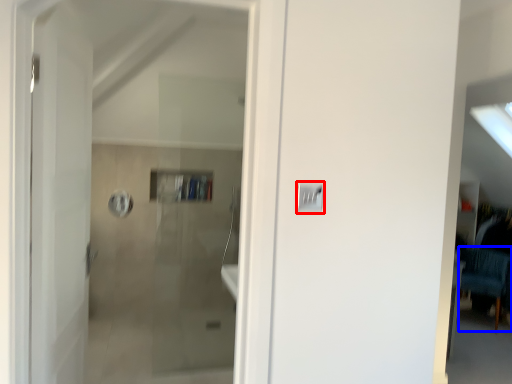
Question: Which of the following is the farthest to the observer, light switch (highlighted by a red box) or furniture (highlighted by a blue box)?

Choices:
 (A) light switch
 (B) furniture

Answer: (B)